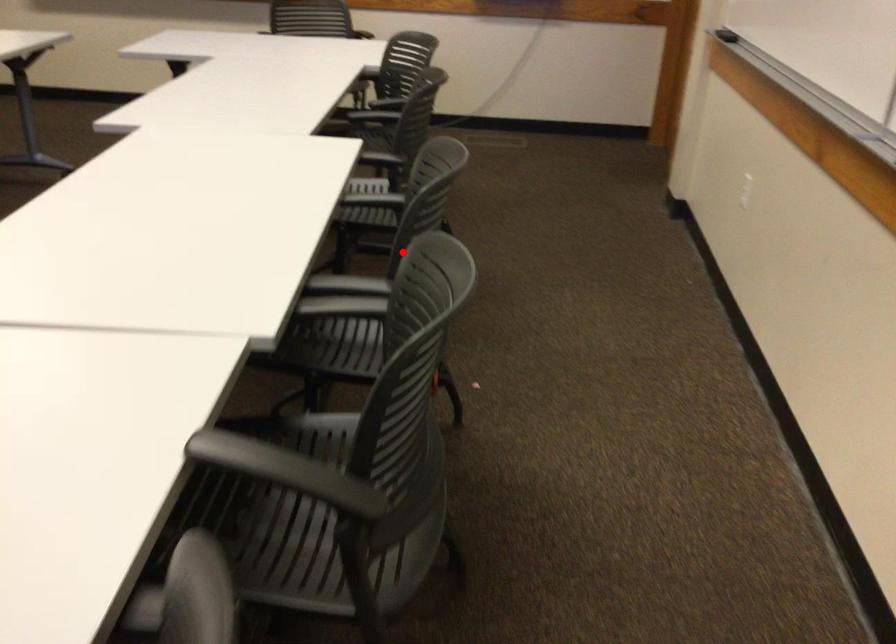
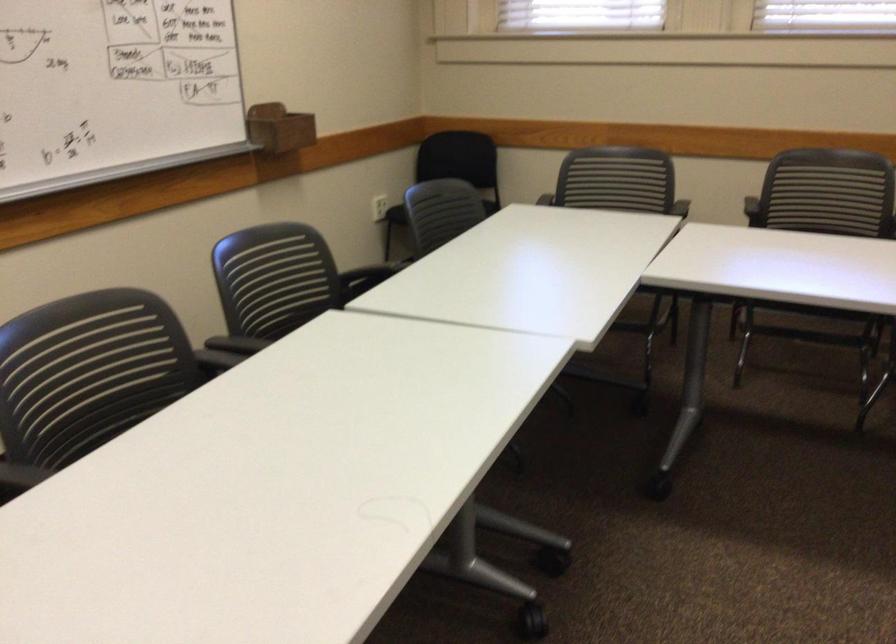
Where in the second image is the point corresponding to the highlighted location from the first image?

(125, 375)